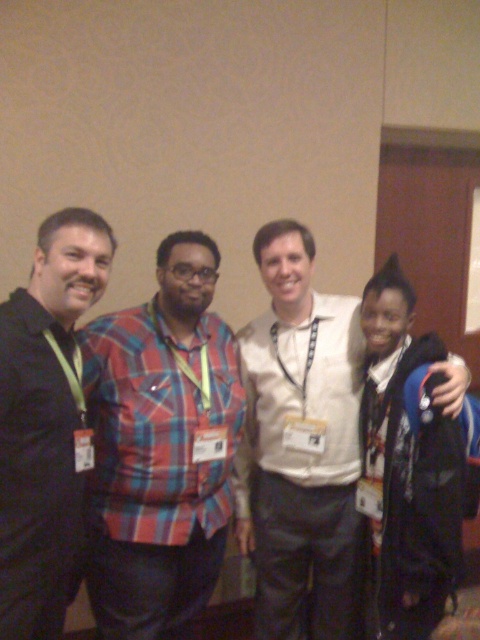
You are organizing a photo shoot and need to ensure that the plaid fabric shirt at center and the black fuzzy hat at right are both visible in the frame. Based on their sizes, which object should you prioritize keeping within the camera frame to avoid cropping?

The plaid fabric shirt at center has a greater width than the black fuzzy hat at right, so you should prioritize keeping the plaid fabric shirt at center in the frame to avoid cropping since it is larger and might require more space.

You are a photographer adjusting the camera settings to capture a group photo of the plaid fabric shirt at center and white matte shirt at center. The camera has a depth of field that can focus on objects within a 10 inch range. Will both shirts be in focus?

The plaid fabric shirt at center and white matte shirt at center are 10.89 inches apart from each other. Since the distance between them exceeds the camera depth of field range of 10 inches, the shirts will not both be in focus simultaneously.